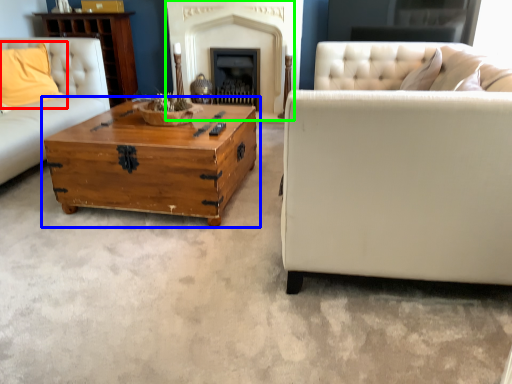
Question: Considering the real-world distances, which object is closest to pillow (highlighted by a red box)? coffee table (highlighted by a blue box) or fireplace (highlighted by a green box).

Choices:
 (A) coffee table
 (B) fireplace

Answer: (A)